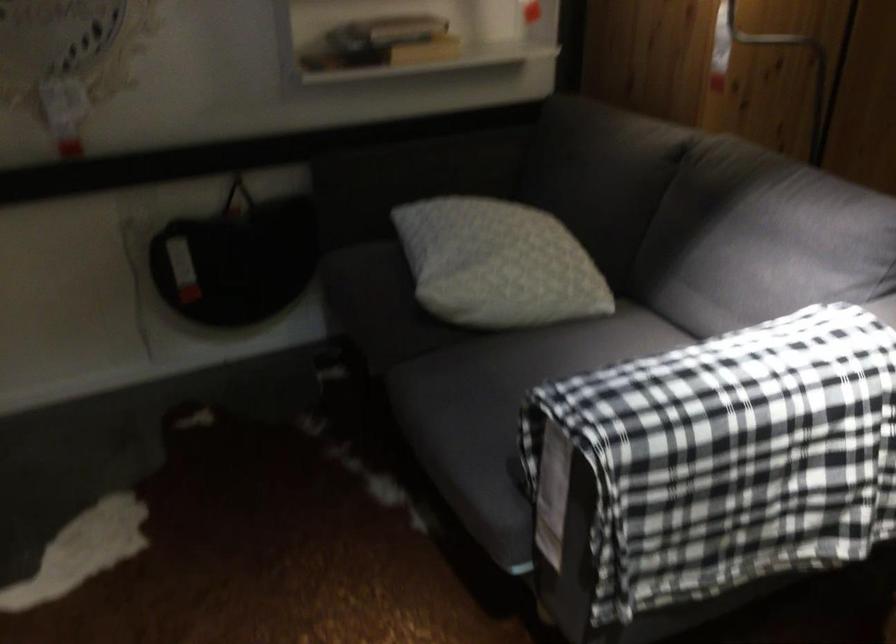
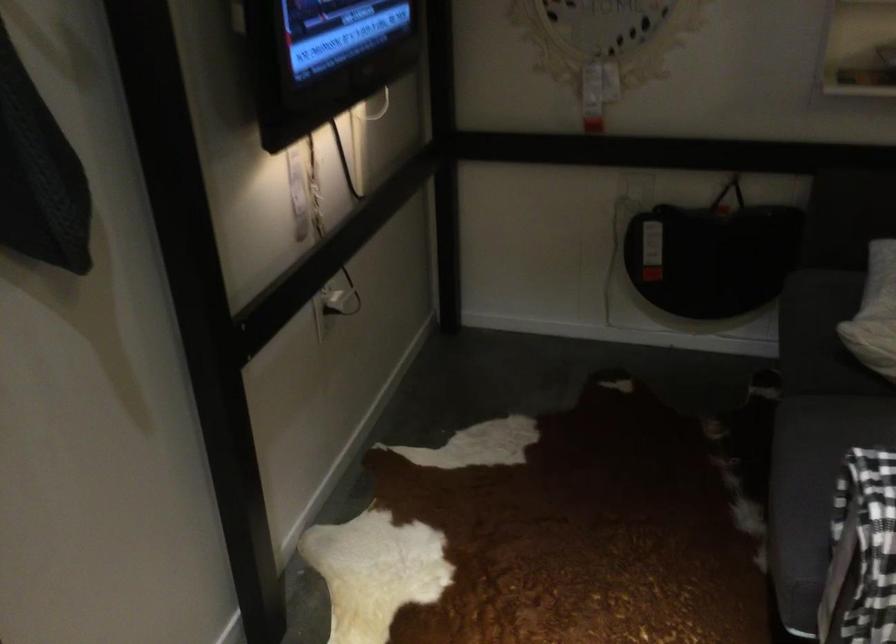
In the second image, find the point that corresponds to (x=435, y=281) in the first image.

(874, 313)